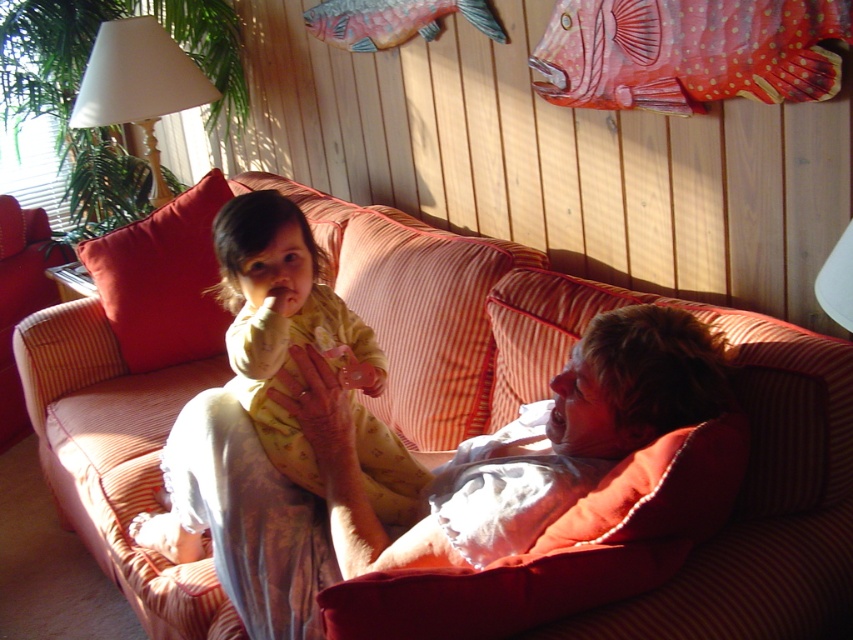
Is the position of matte white blanket at center more distant than that of white fabric lampshade at upper left?

No.

What do you see at coordinates (450, 460) in the screenshot? The height and width of the screenshot is (640, 853). I see `matte white blanket at center` at bounding box center [450, 460].

Identify the location of matte white blanket at center. (450, 460).

Between point (202, 353) and point (177, 109), which one is positioned in front?

Point (202, 353) is in front.

Does red cotton pillow at left have a greater height compared to white fabric lampshade at upper left?

Yes.

In the scene shown: Who is more distant from viewer, (194, 241) or (109, 61)?

Point (109, 61)

Locate an element on the screen. The width and height of the screenshot is (853, 640). red cotton pillow at left is located at coordinates click(163, 280).

Who is positioned more to the left, striped fabric couch at center or matte white blanket at center?

Result: striped fabric couch at center

Can you confirm if striped fabric couch at center is smaller than matte white blanket at center?

Actually, striped fabric couch at center might be larger than matte white blanket at center.

Which is behind, point (770, 372) or point (576, 472)?

The point (770, 372) is behind.

Where is `striped fabric couch at center`? striped fabric couch at center is located at coordinates (679, 452).